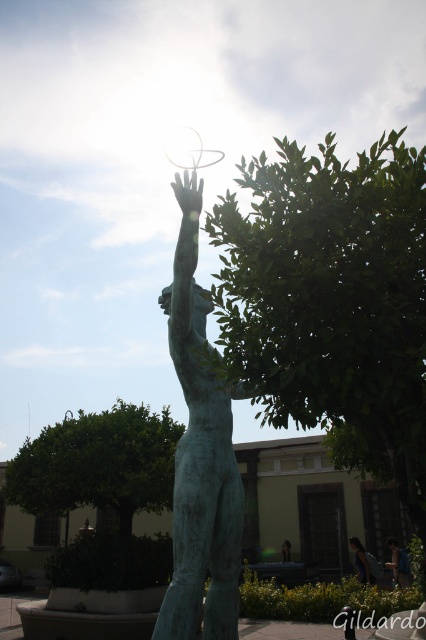
Does green leafy tree at center have a larger size compared to blue-green statue at center?

Yes.

Is green leafy tree at center taller than blue-green statue at center?

Correct, green leafy tree at center is much taller as blue-green statue at center.

Locate an element on the screen. The height and width of the screenshot is (640, 426). green leafy tree at center is located at coordinates (333, 301).

Is point (264, 356) farther from camera compared to point (60, 429)?

No, it is in front of (60, 429).

Between point (399, 252) and point (101, 496), which one is positioned behind?

The point (101, 496) is more distant.

Locate an element on the screen. green leafy tree at center is located at coordinates (333, 301).

Does green patina statue at center come in front of blue-green statue at center?

Yes, green patina statue at center is in front of blue-green statue at center.

Which is more to the right, green patina statue at center or blue-green statue at center?

Positioned to the right is blue-green statue at center.

Where is `green patina statue at center`? The image size is (426, 640). green patina statue at center is located at coordinates (199, 454).